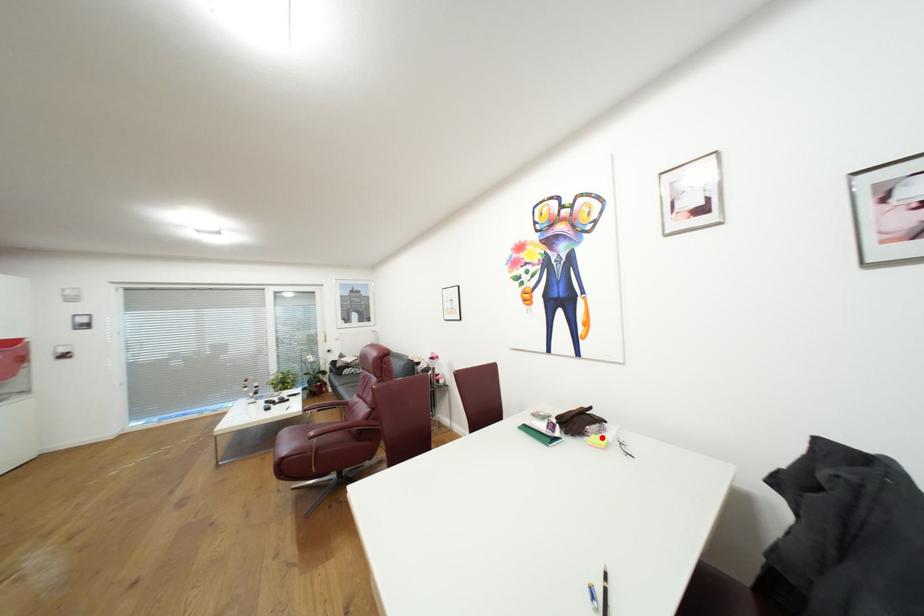
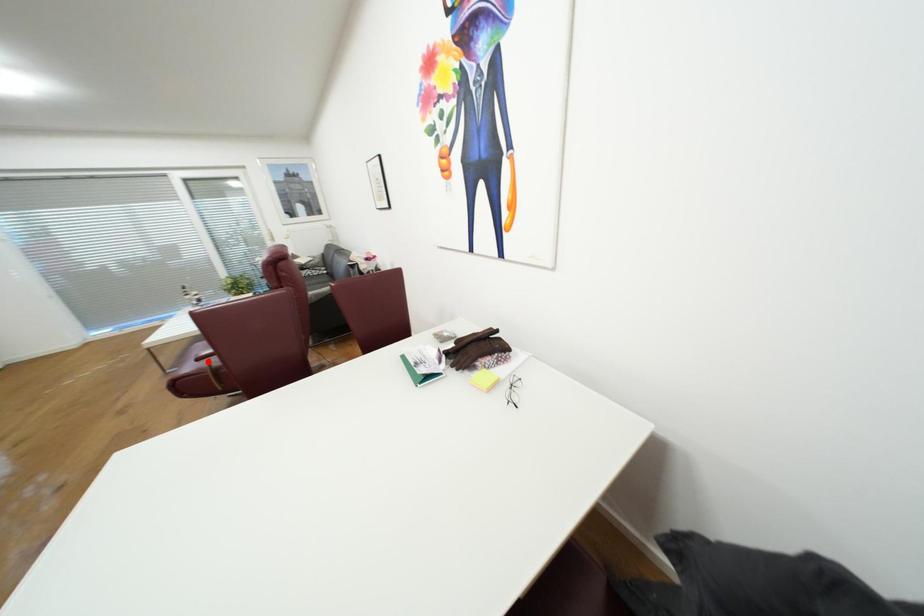
I am providing you with two images of the same scene from different viewpoints. A red point is marked on the first image and another point is marked on the second image. Is the marked point in image1 the same physical position as the marked point in image2?

No